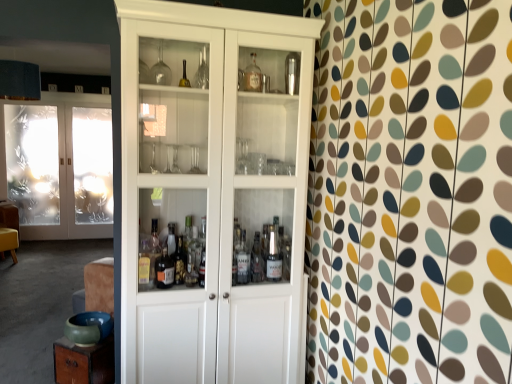
Question: Is transparent plastic screen door at left taller or shorter than white wood cabinet at center?

Choices:
 (A) tall
 (B) short

Answer: (B)

Question: From a real-world perspective, is transparent plastic screen door at left physically located above or below white wood cabinet at center?

Choices:
 (A) below
 (B) above

Answer: (A)

Question: Estimate the real-world distances between objects in this image. Which object is farther from the transparent plastic screen door at left?

Choices:
 (A) white wood cabinet at center
 (B) frosted glass doors at left

Answer: (A)

Question: Which is nearer to the frosted glass doors at left?

Choices:
 (A) transparent plastic screen door at left
 (B) white wood cabinet at center

Answer: (A)